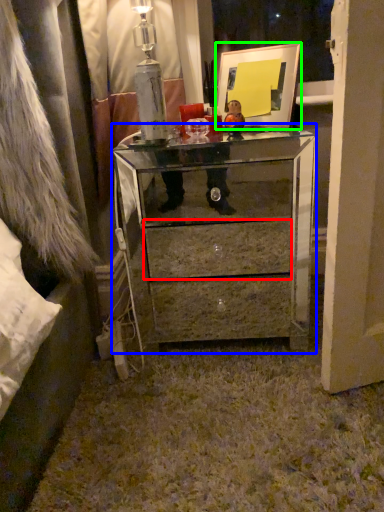
Question: Considering the real-world distances, which object is farthest from drawer (highlighted by a red box)? chest of drawers (highlighted by a blue box) or picture frame (highlighted by a green box)?

Choices:
 (A) chest of drawers
 (B) picture frame

Answer: (B)